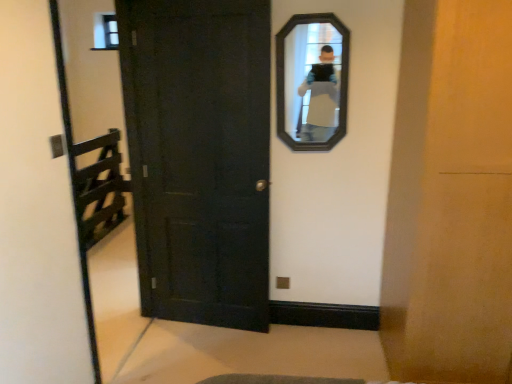
Question: From a real-world perspective, is black wooden mirror at upper center over matte black door at center?

Choices:
 (A) no
 (B) yes

Answer: (B)

Question: Is black wooden mirror at upper center at the left side of matte black door at center?

Choices:
 (A) yes
 (B) no

Answer: (B)

Question: Could you tell me if black wooden mirror at upper center is turned towards matte black door at center?

Choices:
 (A) yes
 (B) no

Answer: (B)

Question: Can you confirm if black wooden mirror at upper center is bigger than matte black door at center?

Choices:
 (A) no
 (B) yes

Answer: (A)

Question: Are black wooden mirror at upper center and matte black door at center beside each other?

Choices:
 (A) yes
 (B) no

Answer: (B)

Question: Is black wooden mirror at upper center not near matte black door at center?

Choices:
 (A) yes
 (B) no

Answer: (B)

Question: Is matte black door at center shorter than black wooden mirror at upper center?

Choices:
 (A) no
 (B) yes

Answer: (A)

Question: Is matte black door at center far from black wooden mirror at upper center?

Choices:
 (A) no
 (B) yes

Answer: (A)

Question: Is matte black door at center aimed at black wooden mirror at upper center?

Choices:
 (A) yes
 (B) no

Answer: (B)

Question: Is matte black door at center taller than black wooden mirror at upper center?

Choices:
 (A) no
 (B) yes

Answer: (B)

Question: Is black wooden mirror at upper center at the back of matte black door at center?

Choices:
 (A) yes
 (B) no

Answer: (B)

Question: Is matte black door at center further to camera compared to black wooden mirror at upper center?

Choices:
 (A) no
 (B) yes

Answer: (A)

Question: In terms of size, does black wooden mirror at upper center appear bigger or smaller than matte black door at center?

Choices:
 (A) big
 (B) small

Answer: (B)